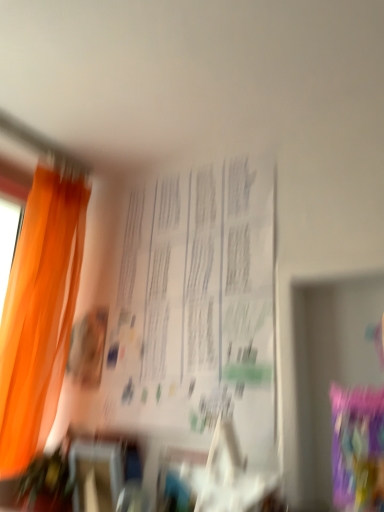
Question: Based on their positions, is orange fabric curtain at left located to the left or right of white paper at center?

Choices:
 (A) left
 (B) right

Answer: (A)

Question: Considering the positions of point (54, 308) and point (248, 220), is point (54, 308) closer or farther from the camera than point (248, 220)?

Choices:
 (A) closer
 (B) farther

Answer: (B)

Question: Is orange fabric curtain at left situated inside white paper at center or outside?

Choices:
 (A) outside
 (B) inside

Answer: (A)

Question: Is white paper at center in front of or behind orange fabric curtain at left in the image?

Choices:
 (A) front
 (B) behind

Answer: (A)

Question: In terms of height, does white paper at center look taller or shorter compared to orange fabric curtain at left?

Choices:
 (A) tall
 (B) short

Answer: (B)

Question: Do you think white paper at center is within orange fabric curtain at left, or outside of it?

Choices:
 (A) inside
 (B) outside

Answer: (B)

Question: Visually, is white paper at center positioned to the left or to the right of orange fabric curtain at left?

Choices:
 (A) right
 (B) left

Answer: (A)